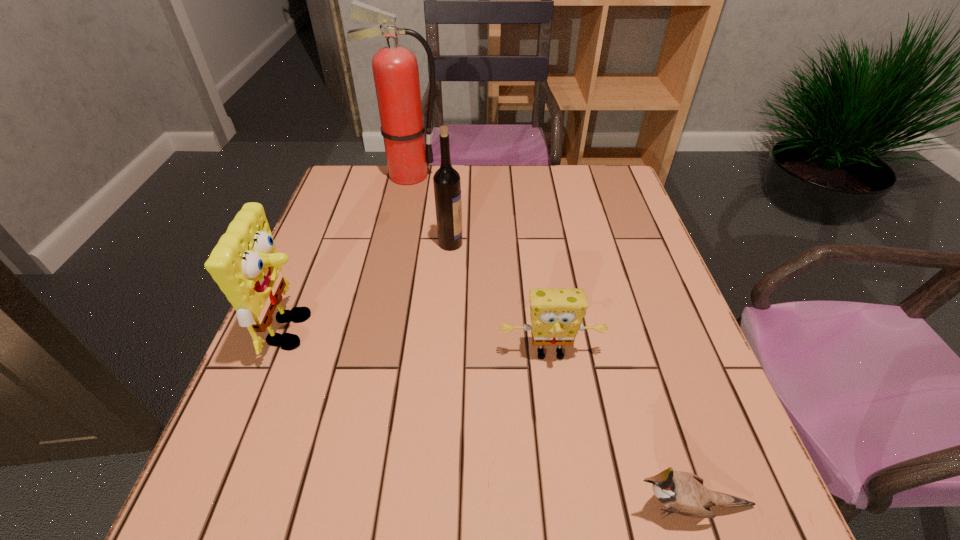
Identify the location of fire extinguisher. This screenshot has width=960, height=540. (395, 69).

What are the coordinates of `the fourth object from right to left` in the screenshot? It's located at (395, 69).

What are the coordinates of `wine bottle` in the screenshot? It's located at (447, 185).

Locate an element on the screen. The width and height of the screenshot is (960, 540). the second farthest object is located at coordinates (447, 185).

The image size is (960, 540). I want to click on the third tallest object, so [x=245, y=264].

Where is `the taller sponge`? the taller sponge is located at coordinates (245, 264).

This screenshot has height=540, width=960. In order to click on the right sponge in this screenshot , I will do `click(556, 315)`.

At what (x,y) coordinates should I click in order to perform the action: click on the nearest object. Please return your answer as a coordinate pair (x, y). This screenshot has width=960, height=540. Looking at the image, I should click on (683, 493).

This screenshot has height=540, width=960. I want to click on the shortest object, so click(683, 493).

The height and width of the screenshot is (540, 960). I want to click on free space located 0.080m on the hose direction of the tallest object, so click(468, 175).